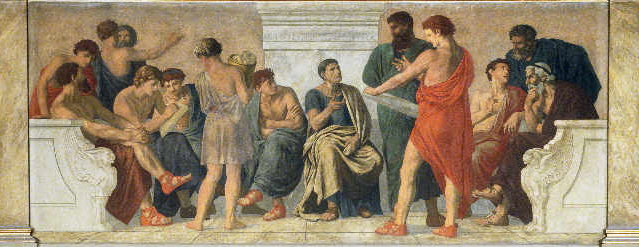
The image size is (639, 247). I want to click on pillar, so click(320, 22), click(3, 105), click(626, 108).